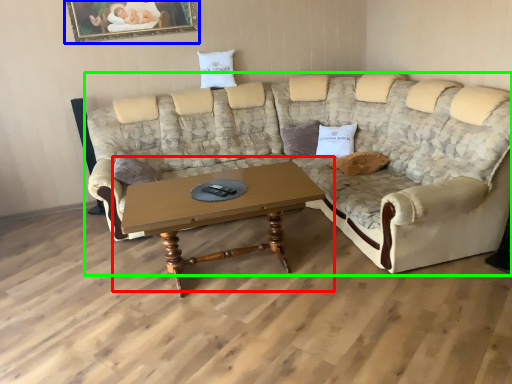
Question: Which is nearer to the coffee table (highlighted by a red box)? picture frame (highlighted by a blue box) or studio couch (highlighted by a green box).

Choices:
 (A) picture frame
 (B) studio couch

Answer: (B)